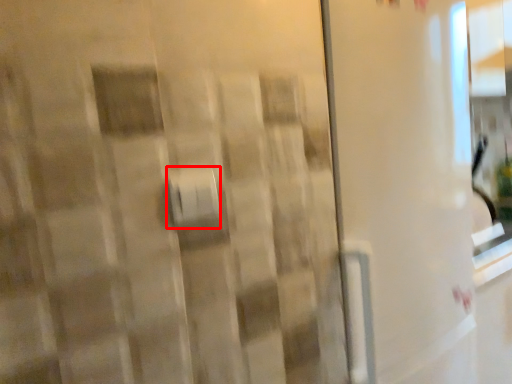
Question: In this image, where is towel bar (annotated by the red box) located relative to screen door?

Choices:
 (A) left
 (B) right

Answer: (A)